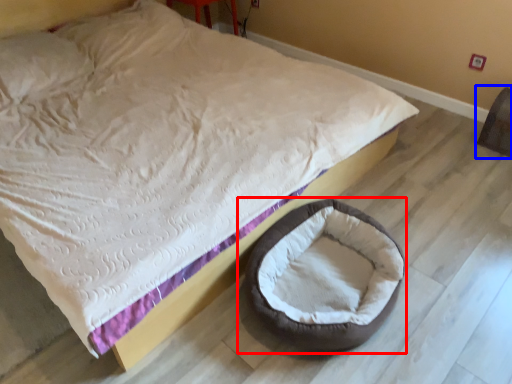
Question: Which object is further to the camera taking this photo, dog bed (highlighted by a red box) or bean bag chair (highlighted by a blue box)?

Choices:
 (A) dog bed
 (B) bean bag chair

Answer: (B)